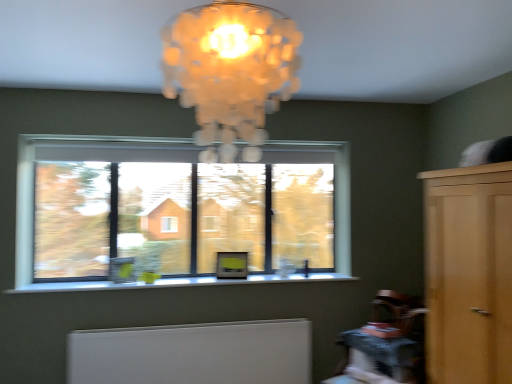
Locate an element on the screen. The width and height of the screenshot is (512, 384). white matte radiator at lower center is located at coordinates (194, 353).

At what (x,y) coordinates should I click in order to perform the action: click on light brown wood dresser at right. Please return your answer as a coordinate pair (x, y). The width and height of the screenshot is (512, 384). Looking at the image, I should click on (468, 274).

The height and width of the screenshot is (384, 512). Describe the element at coordinates (230, 71) in the screenshot. I see `translucent glass chandelier at upper center` at that location.

At what (x,y) coordinates should I click in order to perform the action: click on clear glass window at center. Please return your answer as a coordinate pair (x, y). This screenshot has height=384, width=512. Looking at the image, I should click on (175, 211).

Can you tell me how much white smooth window sill at center and clear glass window at center differ in facing direction?

white smooth window sill at center and clear glass window at center are facing 1.21 degrees away from each other.

Is white smooth window sill at center shorter than clear glass window at center?

Indeed, white smooth window sill at center has a lesser height compared to clear glass window at center.

Which is more to the left, white smooth window sill at center or clear glass window at center?

Positioned to the left is clear glass window at center.

Is white matte radiator at lower center not inside white smooth window sill at center?

Absolutely, white matte radiator at lower center is external to white smooth window sill at center.

Does white matte radiator at lower center have a larger size compared to white smooth window sill at center?

Yes, white matte radiator at lower center is bigger than white smooth window sill at center.

This screenshot has width=512, height=384. What are the coordinates of `radiator below the white smooth window sill at center (from the image's perspective)` in the screenshot? It's located at (194, 353).

Between white matte radiator at lower center and white smooth window sill at center, which one has more height?

With more height is white matte radiator at lower center.

Considering the sizes of objects clear glass window at center and translucent glass chandelier at upper center in the image provided, who is thinner, clear glass window at center or translucent glass chandelier at upper center?

clear glass window at center is thinner.

From a real-world perspective, does clear glass window at center stand above translucent glass chandelier at upper center?

Actually, clear glass window at center is physically below translucent glass chandelier at upper center in the real world.

How many degrees apart are the facing directions of clear glass window at center and translucent glass chandelier at upper center?

The facing directions of clear glass window at center and translucent glass chandelier at upper center are 91.3 degrees apart.

Considering the relative sizes of clear glass window at center and translucent glass chandelier at upper center in the image provided, is clear glass window at center shorter than translucent glass chandelier at upper center?

Incorrect, the height of clear glass window at center does not fall short of that of translucent glass chandelier at upper center.

Is white smooth window sill at center facing towards light brown wood dresser at right?

No, white smooth window sill at center is not facing towards light brown wood dresser at right.

Is white smooth window sill at center to the right of light brown wood dresser at right from the viewer's perspective?

In fact, white smooth window sill at center is to the left of light brown wood dresser at right.

This screenshot has height=384, width=512. In order to click on dresser above the white smooth window sill at center (from the image's perspective) in this screenshot , I will do `click(468, 274)`.

Does point (305, 376) lie behind point (392, 371)?

Yes, it is.

From a real-world perspective, is white matte radiator at lower center positioned above or below wooden textured table at lower right?

In terms of real-world spatial position, white matte radiator at lower center is below wooden textured table at lower right.

Identify the location of table in front of the white matte radiator at lower center. Image resolution: width=512 pixels, height=384 pixels. (383, 350).

Considering the positions of objects white matte radiator at lower center and wooden textured table at lower right in the image provided, who is behind, white matte radiator at lower center or wooden textured table at lower right?

white matte radiator at lower center is further away from the camera.

From a real-world perspective, between wooden textured table at lower right and clear glass window at center, who is vertically lower?

wooden textured table at lower right, from a real-world perspective.

Is wooden textured table at lower right positioned with its back to clear glass window at center?

No, clear glass window at center is not at the back of wooden textured table at lower right.

Looking at this image, which is closer, (380, 353) or (277, 149)?

Point (380, 353) is positioned closer to the camera compared to point (277, 149).

Can we say wooden textured table at lower right lies outside clear glass window at center?

Indeed, wooden textured table at lower right is completely outside clear glass window at center.

Is light brown wood dresser at right facing towards white smooth window sill at center?

No, light brown wood dresser at right does not turn towards white smooth window sill at center.

From a real-world perspective, between light brown wood dresser at right and white smooth window sill at center, who is vertically lower?

white smooth window sill at center.

Considering the relative sizes of light brown wood dresser at right and white smooth window sill at center in the image provided, is light brown wood dresser at right thinner than white smooth window sill at center?

No, light brown wood dresser at right is not thinner than white smooth window sill at center.

In order to click on window sill that appears below the clear glass window at center (from the image's perspective) in this screenshot , I will do `click(176, 283)`.

I want to click on window sill lying on the left of white matte radiator at lower center, so click(176, 283).

Considering their positions, is white smooth window sill at center positioned closer to wooden textured table at lower right than white matte radiator at lower center?

white matte radiator at lower center.

Which object lies further to the anchor point white smooth window sill at center, wooden textured table at lower right or white matte radiator at lower center?

wooden textured table at lower right is positioned further to the anchor white smooth window sill at center.

Looking at the image, which one is located further to wooden textured table at lower right, translucent glass chandelier at upper center or light brown wood dresser at right?

The object further to wooden textured table at lower right is translucent glass chandelier at upper center.

Looking at the image, which one is located closer to wooden textured table at lower right, translucent glass chandelier at upper center or white matte radiator at lower center?

white matte radiator at lower center is positioned closer to the anchor wooden textured table at lower right.

Which object lies further to the anchor point white matte radiator at lower center, translucent glass chandelier at upper center or wooden textured table at lower right?

translucent glass chandelier at upper center is further to white matte radiator at lower center.

Estimate the real-world distances between objects in this image. Which object is further from wooden textured table at lower right, light brown wood dresser at right or translucent glass chandelier at upper center?

translucent glass chandelier at upper center is further to wooden textured table at lower right.

Estimate the real-world distances between objects in this image. Which object is closer to wooden textured table at lower right, clear glass window at center or translucent glass chandelier at upper center?

Based on the image, clear glass window at center appears to be nearer to wooden textured table at lower right.

Looking at the image, which one is located further to clear glass window at center, white matte radiator at lower center or wooden textured table at lower right?

The object further to clear glass window at center is wooden textured table at lower right.

Find the location of a particular element. radiator between white smooth window sill at center and light brown wood dresser at right is located at coordinates (194, 353).

Locate an element on the screen. table situated between white matte radiator at lower center and light brown wood dresser at right from left to right is located at coordinates (383, 350).

The image size is (512, 384). I want to click on radiator between white smooth window sill at center and wooden textured table at lower right, so click(x=194, y=353).

This screenshot has height=384, width=512. I want to click on window sill between clear glass window at center and white matte radiator at lower center in the vertical direction, so click(176, 283).